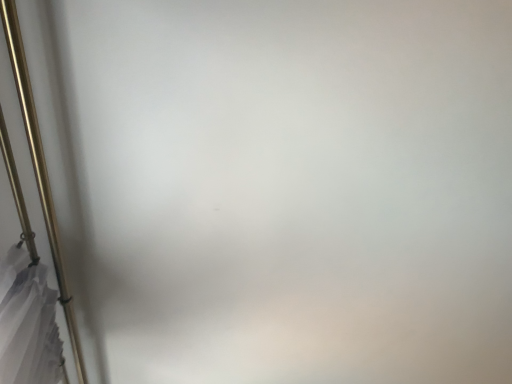
Question: Should I look upward or downward to see gold metallic pipe at left?

Choices:
 (A) up
 (B) down

Answer: (B)